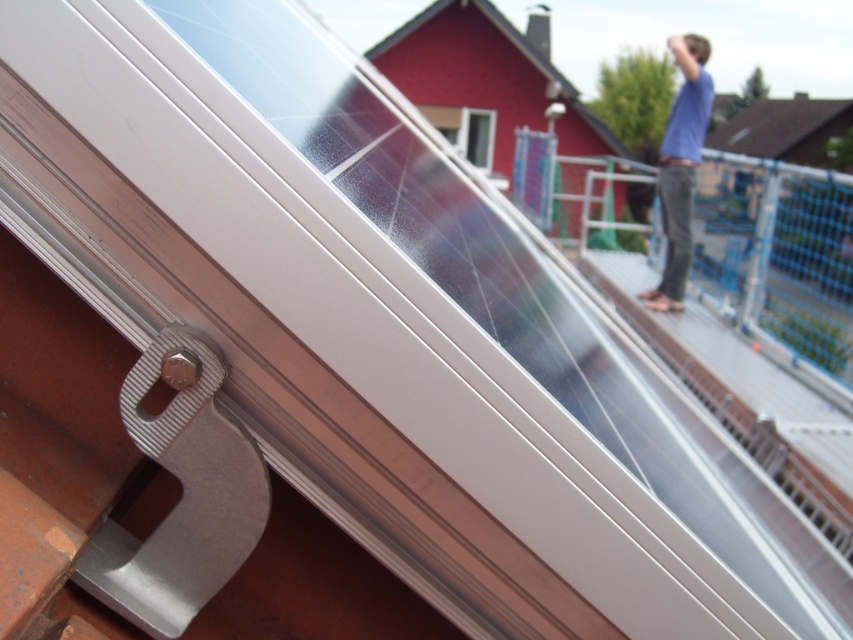
Between point (662, 305) and point (482, 148), which one is positioned behind?

Point (482, 148)

From the picture: Can you confirm if blue cotton shirt at upper right is positioned below transparent glass window at upper center?

Yes, blue cotton shirt at upper right is below transparent glass window at upper center.

The height and width of the screenshot is (640, 853). I want to click on blue cotton shirt at upper right, so coord(680,168).